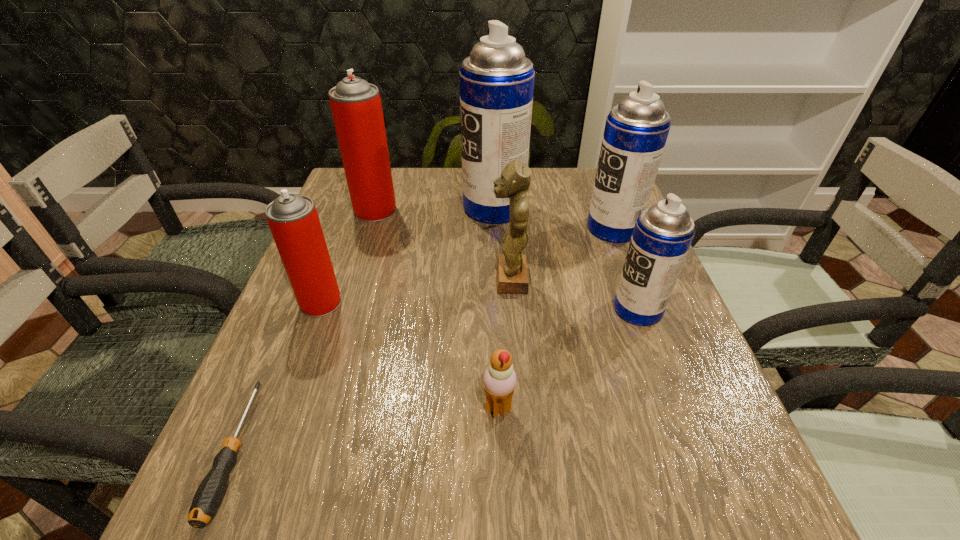
Locate an element on the screen. The image size is (960, 540). object located at the near left corner is located at coordinates (209, 494).

Find the location of a particular element. This screenshot has height=540, width=960. free space at the far edge of the desktop is located at coordinates (430, 207).

The image size is (960, 540). Identify the location of free spot at the left edge of the desktop. (347, 362).

Where is `free space at the right edge of the desktop`? The width and height of the screenshot is (960, 540). free space at the right edge of the desktop is located at coordinates (611, 323).

The height and width of the screenshot is (540, 960). In the image, there is a desktop. Find the location of `free space at the near left corner`. free space at the near left corner is located at coordinates (231, 489).

Locate an element on the screen. free point between the farther red aerosol can and the figurine is located at coordinates (443, 245).

The height and width of the screenshot is (540, 960). What are the coordinates of `free point between the nearest blue aerosol can and the third aerosol can from left to right` in the screenshot? It's located at (565, 258).

Image resolution: width=960 pixels, height=540 pixels. Identify the location of free space that is in between the smaller red aerosol can and the nearest blue aerosol can. (479, 306).

The image size is (960, 540). In order to click on blank region between the second biggest blue aerosol can and the tallest object in this screenshot , I will do `click(553, 218)`.

The image size is (960, 540). I want to click on vacant point located between the shortest object and the bigger red aerosol can, so click(305, 330).